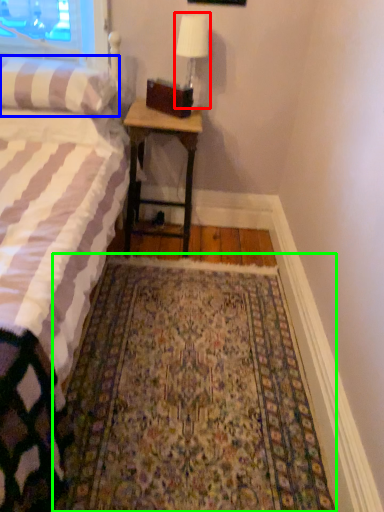
Question: Considering the real-world distances, which object is farthest from bedside lamp (highlighted by a red box)? pillow (highlighted by a blue box) or mat (highlighted by a green box)?

Choices:
 (A) pillow
 (B) mat

Answer: (B)